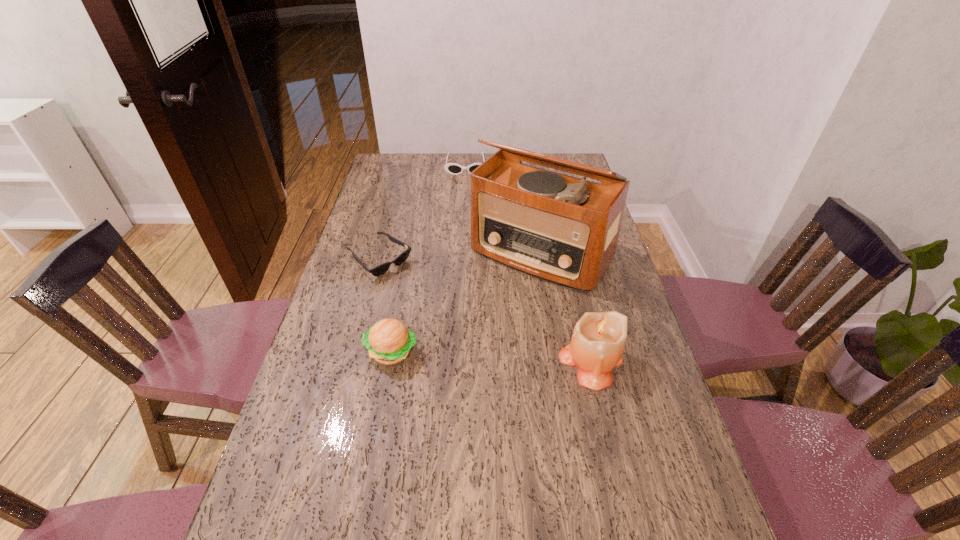
Locate an element on the screen. Image resolution: width=960 pixels, height=540 pixels. free space on the desktop that is between the hamburger and the fourth shortest object and is positioned with the lenses of the farthest object facing outward is located at coordinates (463, 355).

Find the location of `vacant space on the desktop that is between the third tallest object and the second tallest object and is positioned on the front-facing side of the nearer sunglasses`. vacant space on the desktop that is between the third tallest object and the second tallest object and is positioned on the front-facing side of the nearer sunglasses is located at coordinates (502, 357).

At what (x,y) coordinates should I click in order to perform the action: click on vacant spot on the desktop that is between the third shortest object and the candle and is positioned on the front panel of the tallest object. Please return your answer as a coordinate pair (x, y). Looking at the image, I should click on (462, 355).